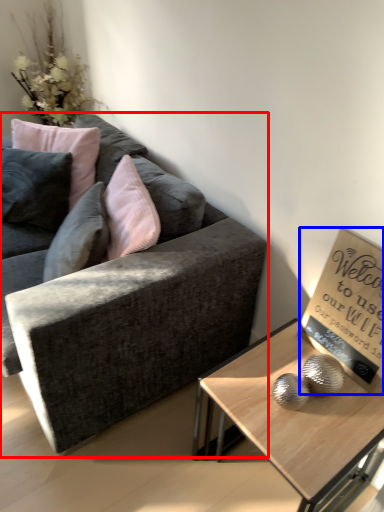
Question: Among these objects, which one is farthest to the camera, studio couch (highlighted by a red box) or bulletin board (highlighted by a blue box)?

Choices:
 (A) studio couch
 (B) bulletin board

Answer: (B)